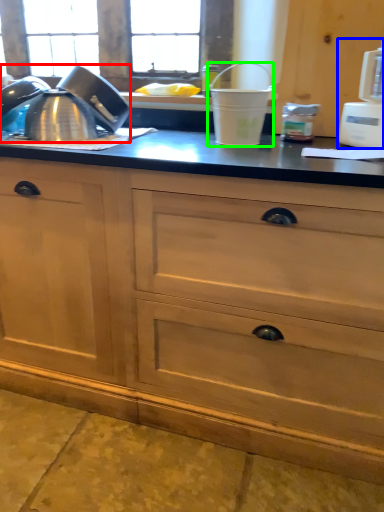
Question: Which object is positioned farthest from tea pot (highlighted by a red box)? Select from appliance (highlighted by a blue box) and appliance (highlighted by a green box).

Choices:
 (A) appliance
 (B) appliance

Answer: (A)